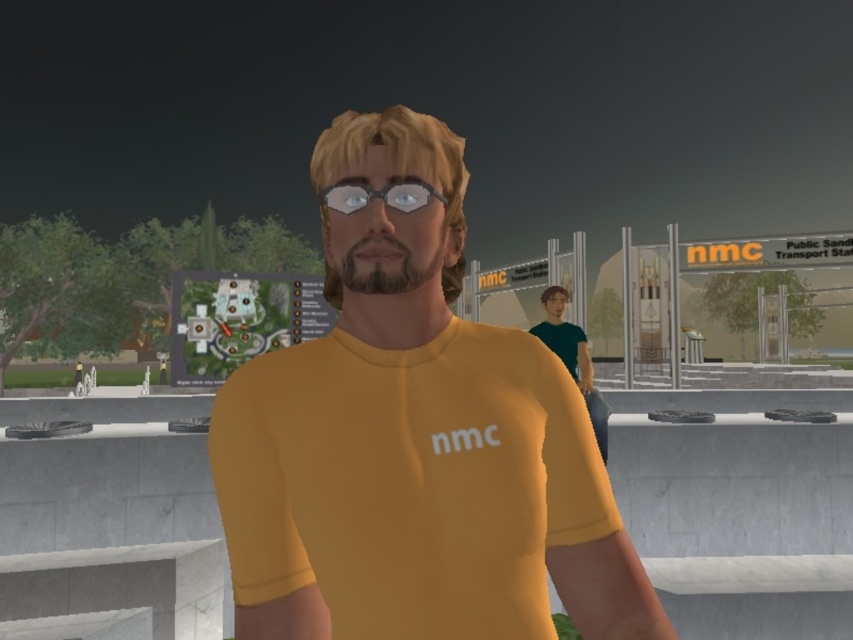
Question: Is yellow matte shirt at center below transparent plastic goggles at center?

Choices:
 (A) yes
 (B) no

Answer: (A)

Question: Among these points, which one is farthest from the camera?

Choices:
 (A) (345, 182)
 (B) (410, 595)

Answer: (A)

Question: Can you confirm if yellow matte shirt at center is smaller than transparent plastic goggles at center?

Choices:
 (A) yes
 (B) no

Answer: (B)

Question: Does yellow matte shirt at center appear over transparent plastic goggles at center?

Choices:
 (A) yes
 (B) no

Answer: (B)